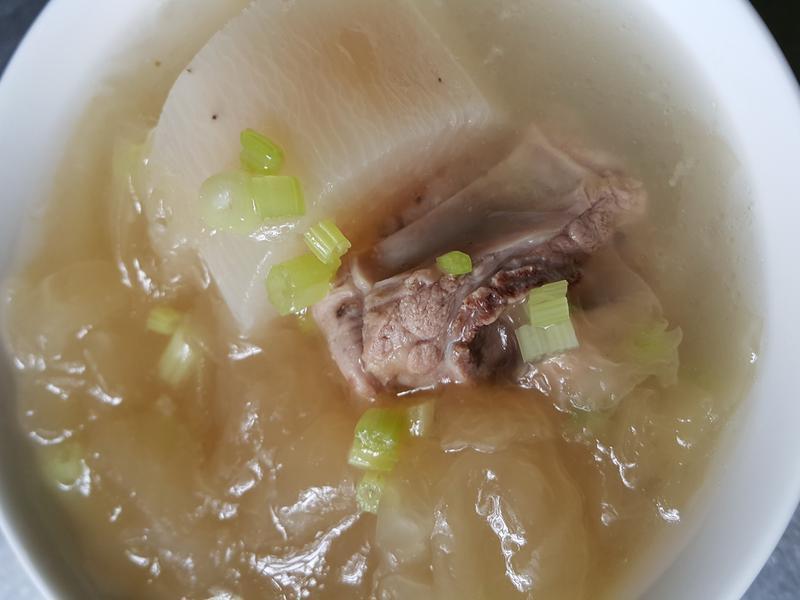
I want to click on bowl, so click(744, 511).